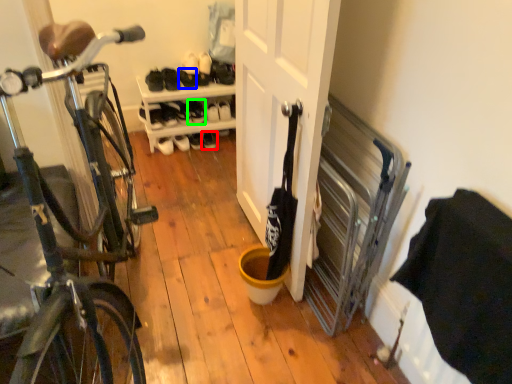
Question: Estimate the real-world distances between objects in this image. Which object is farther from footwear (highlighted by a red box), shoe (highlighted by a blue box) or shoe (highlighted by a green box)?

Choices:
 (A) shoe
 (B) shoe

Answer: (A)